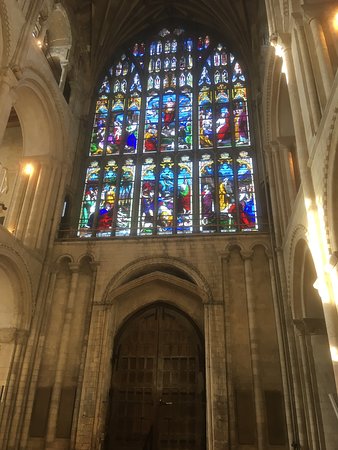
This screenshot has width=338, height=450. What are the coordinates of `archway` in the screenshot? It's located at (126, 275).